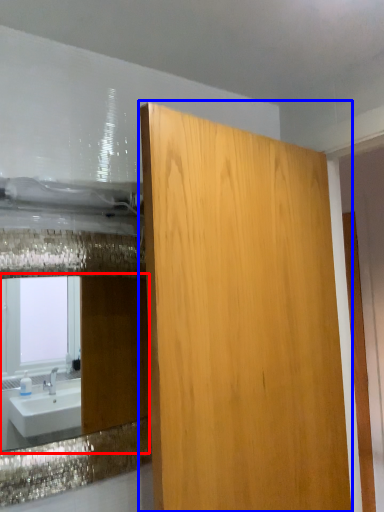
Question: Which of the following is the closest to the observer, mirror (highlighted by a red box) or bathroom cabinet (highlighted by a blue box)?

Choices:
 (A) mirror
 (B) bathroom cabinet

Answer: (B)